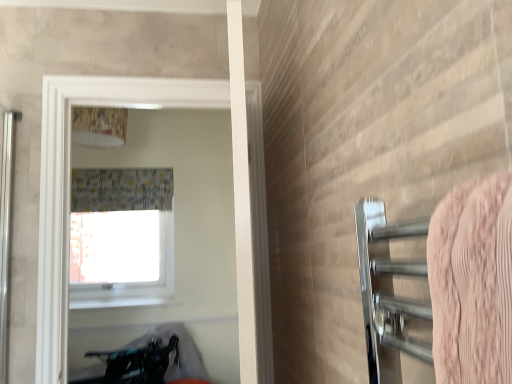
Question: From the image's perspective, is white glossy lampshade at upper center beneath transparent glass window at upper center?

Choices:
 (A) yes
 (B) no

Answer: (B)

Question: Is transparent glass window at upper center at the back of white glossy lampshade at upper center?

Choices:
 (A) yes
 (B) no

Answer: (B)

Question: Is white glossy lampshade at upper center at the left side of transparent glass window at upper center?

Choices:
 (A) no
 (B) yes

Answer: (B)

Question: Can you confirm if white glossy lampshade at upper center is thinner than transparent glass window at upper center?

Choices:
 (A) yes
 (B) no

Answer: (A)

Question: Is white glossy lampshade at upper center facing towards transparent glass window at upper center?

Choices:
 (A) no
 (B) yes

Answer: (A)

Question: Based on their sizes in the image, would you say white glossy window at upper center is bigger or smaller than gray fabric shower curtain at upper center?

Choices:
 (A) small
 (B) big

Answer: (B)

Question: Is point (181, 94) positioned closer to the camera than point (84, 190)?

Choices:
 (A) closer
 (B) farther

Answer: (A)

Question: Do you think white glossy window at upper center is within gray fabric shower curtain at upper center, or outside of it?

Choices:
 (A) inside
 (B) outside

Answer: (B)

Question: From their relative heights in the image, would you say white glossy window at upper center is taller or shorter than gray fabric shower curtain at upper center?

Choices:
 (A) tall
 (B) short

Answer: (A)

Question: Considering their positions, is white glossy window at upper center located in front of or behind transparent glass window at upper center?

Choices:
 (A) behind
 (B) front

Answer: (B)

Question: From a real-world perspective, is white glossy window at upper center physically located above or below transparent glass window at upper center?

Choices:
 (A) below
 (B) above

Answer: (B)

Question: Visually, is white glossy window at upper center positioned to the left or to the right of transparent glass window at upper center?

Choices:
 (A) right
 (B) left

Answer: (A)

Question: From the image's perspective, relative to transparent glass window at upper center, is white glossy window at upper center above or below?

Choices:
 (A) above
 (B) below

Answer: (A)

Question: In the image, is gray fabric shower curtain at upper center positioned in front of or behind transparent glass window at upper center?

Choices:
 (A) front
 (B) behind

Answer: (A)

Question: From the image's perspective, is gray fabric shower curtain at upper center above or below transparent glass window at upper center?

Choices:
 (A) above
 (B) below

Answer: (A)